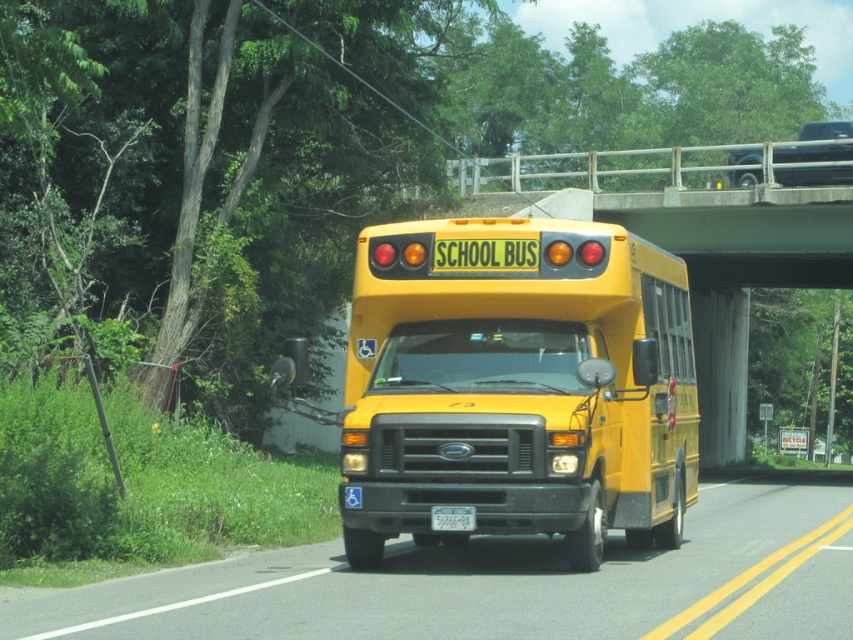
Based on the photo, you are a pedestrian standing at point (589,632) and want to cross the road to reach the other side. There is a school bus at point (422,378). Is the bus between you and the road you want to cross?

Point (422,378) is behind point (589,632), so the school bus at point (422,378) is behind you and not between you and the road you want to cross.

You are a driver approaching the yellow matte school bus at center and the white plastic license plate at center. Which object will appear bigger in your view?

The yellow matte school bus at center is larger in size than the white plastic license plate at center, so it will appear bigger in your view.